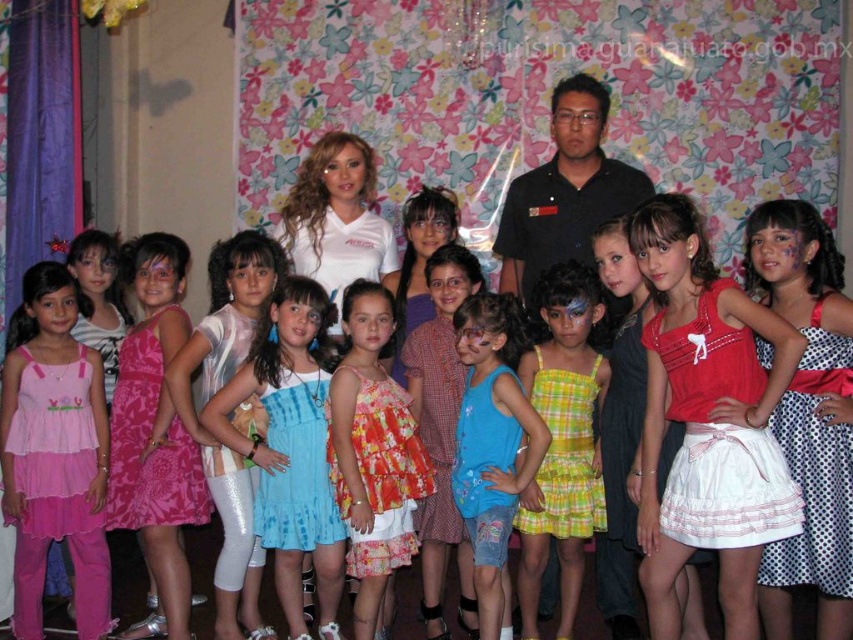
In the scene shown: Is blue tie-dye dress at center positioned at the back of yellow plaid dress at center?

That is True.

In the scene shown: Is blue tie-dye dress at center taller than yellow plaid dress at center?

No.

This screenshot has width=853, height=640. In order to click on blue tie-dye dress at center in this screenshot , I will do `click(289, 445)`.

Consider the image. Between pink satin dress at center and blue tie-dye dress at center, which one appears on the right side from the viewer's perspective?

blue tie-dye dress at center

Is pink satin dress at center in front of blue tie-dye dress at center?

No, it is not.

Locate an element on the screen. pink satin dress at center is located at coordinates (54, 452).

Identify the location of pink satin dress at center. (54, 452).

Measure the distance between yellow plaid dress at center and floral fabric dress at center.

yellow plaid dress at center is 64.94 centimeters from floral fabric dress at center.

Based on the photo, does yellow plaid dress at center have a larger size compared to floral fabric dress at center?

Yes, yellow plaid dress at center is bigger than floral fabric dress at center.

Measure the distance between point (583, 481) and camera.

Point (583, 481) is 12.36 feet away from camera.

At what (x,y) coordinates should I click in order to perform the action: click on yellow plaid dress at center. Please return your answer as a coordinate pair (x, y). The width and height of the screenshot is (853, 640). Looking at the image, I should click on (561, 442).